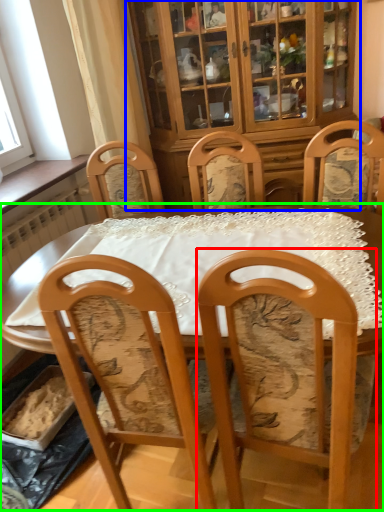
Question: Which object is the closest to the chair (highlighted by a red box)? Choose among these: cabinetry (highlighted by a blue box) or table (highlighted by a green box).

Choices:
 (A) cabinetry
 (B) table

Answer: (B)